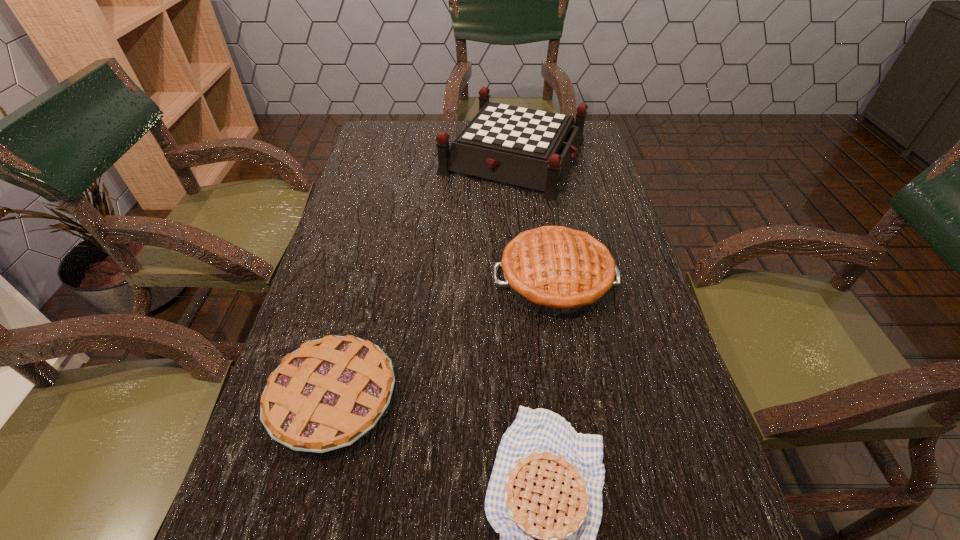
Identify the location of empty location between the third nearest object and the tallest object. (535, 218).

What are the coordinates of `vacant region between the farthest object and the leftmost pie` in the screenshot? It's located at (423, 277).

Locate which object is the second closest to the farthest object. Please provide its 2D coordinates. Your answer should be formatted as a tuple, i.e. [(x, y)], where the tuple contains the x and y coordinates of a point satisfying the conditions above.

[(325, 395)]

I want to click on object that can be found as the second closest to the checkerboard, so click(x=325, y=395).

The width and height of the screenshot is (960, 540). I want to click on pie identified as the second closest to the farthest pie, so click(x=544, y=497).

At what (x,y) coordinates should I click in order to perform the action: click on pie identified as the closest to the second farthest object. Please return your answer as a coordinate pair (x, y). The image size is (960, 540). Looking at the image, I should click on (325, 395).

The height and width of the screenshot is (540, 960). I want to click on free location that satisfies the following two spatial constraints: 1. on the front side of the farthest object; 2. on the left side of the tallest pie, so click(x=526, y=280).